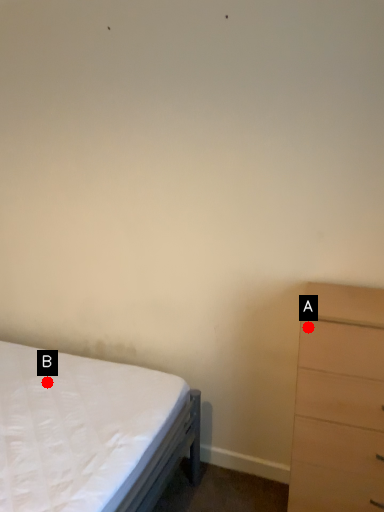
Question: Two points are circled on the image, labeled by A and B beside each circle. Which of the following is the farthest from the observer?

Choices:
 (A) A is further
 (B) B is further

Answer: (B)